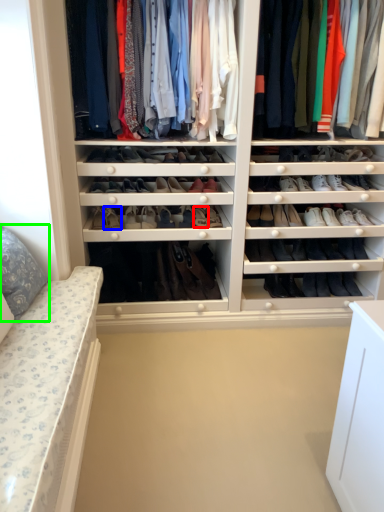
Question: Which is farther away from shoe (highlighted by a red box)? shoe (highlighted by a blue box) or pillow (highlighted by a green box)?

Choices:
 (A) shoe
 (B) pillow

Answer: (B)